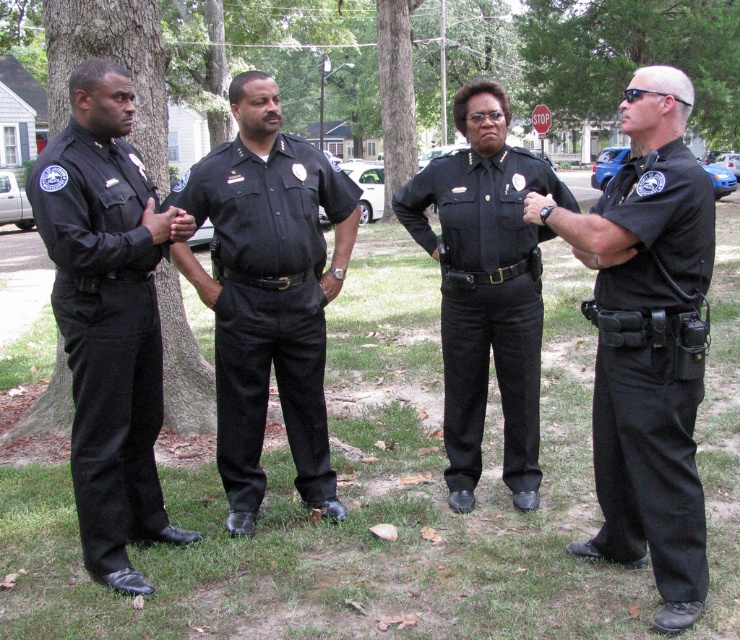
You are a photographer trying to capture a group photo of the black matte uniform at right and the black matte uniform at center. Since you want both uniforms to appear equally wide in the photo, which adjustment should you make?

The black matte uniform at right is thinner than the black matte uniform at center, so to make them appear equally wide in the photo, you should move the camera closer to the black matte uniform at right or farther from the black matte uniform at center.